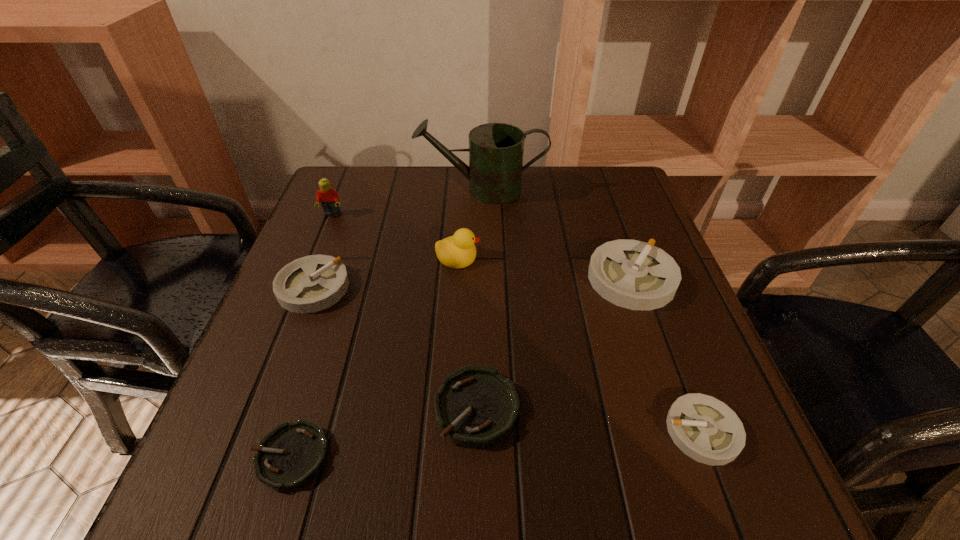
Locate an element on the screen. This screenshot has width=960, height=540. free space between the duckling and the second biggest gray ashtray is located at coordinates (386, 272).

The width and height of the screenshot is (960, 540). I want to click on free space between the Lego and the nearest gray ashtray, so click(517, 323).

Locate an element on the screen. Image resolution: width=960 pixels, height=540 pixels. unoccupied area between the yellow duckling and the second tallest object is located at coordinates (396, 235).

Where is `vacant area between the fifth shortest object and the nearest gray ashtray`? This screenshot has width=960, height=540. vacant area between the fifth shortest object and the nearest gray ashtray is located at coordinates (667, 355).

Identify the location of vacant point located between the fourth shortest object and the bigger green ashtray. (396, 348).

I want to click on vacant area that lies between the second tallest object and the third ashtray from right to left, so click(404, 311).

Where is `vacant area that lies between the watering can and the duckling`? Image resolution: width=960 pixels, height=540 pixels. vacant area that lies between the watering can and the duckling is located at coordinates (469, 223).

Select which object is the second closest to the Lego. Please provide its 2D coordinates. Your answer should be formatted as a tuple, i.e. [(x, y)], where the tuple contains the x and y coordinates of a point satisfying the conditions above.

[(496, 150)]

Locate an element on the screen. This screenshot has width=960, height=540. object that is the second closest to the tallest ashtray is located at coordinates (704, 428).

Locate which ashtray ranks second in proximity to the nearest gray ashtray. Please provide its 2D coordinates. Your answer should be formatted as a tuple, i.e. [(x, y)], where the tuple contains the x and y coordinates of a point satisfying the conditions above.

[(477, 407)]